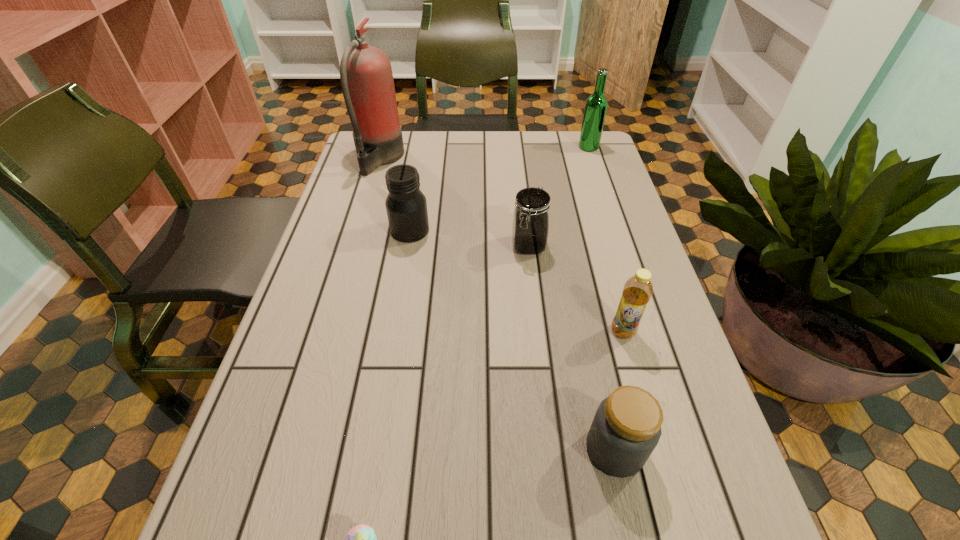
Where is `bottle that is at the right edge`? The image size is (960, 540). bottle that is at the right edge is located at coordinates (638, 289).

The image size is (960, 540). I want to click on jar that is at the right edge, so click(x=626, y=428).

At what (x,y) coordinates should I click in order to perform the action: click on object present at the far left corner. Please return your answer as a coordinate pair (x, y). Looking at the image, I should click on (366, 76).

This screenshot has width=960, height=540. I want to click on object positioned at the far right corner, so click(596, 105).

You are a GUI agent. You are given a task and a screenshot of the screen. Output one action in this format:
    pyautogui.click(x=<x>, y=<y>)
    Task: Click on the vacant area at the far edge of the desktop
    The image size is (960, 540).
    Given the screenshot: What is the action you would take?
    pyautogui.click(x=474, y=148)

In the image, there is a desktop. Where is `free region at the left edge`? The image size is (960, 540). free region at the left edge is located at coordinates (343, 363).

Locate an element on the screen. vacant space at the right edge of the desktop is located at coordinates (618, 195).

This screenshot has height=540, width=960. Identify the location of vacant region between the third nearest object and the tallest object. (501, 245).

Locate an element on the screen. free space between the tallest object and the rightmost jar is located at coordinates (497, 304).

Locate an element on the screen. The width and height of the screenshot is (960, 540). vacant area that lies between the fire extinguisher and the nearest jar is located at coordinates (497, 304).